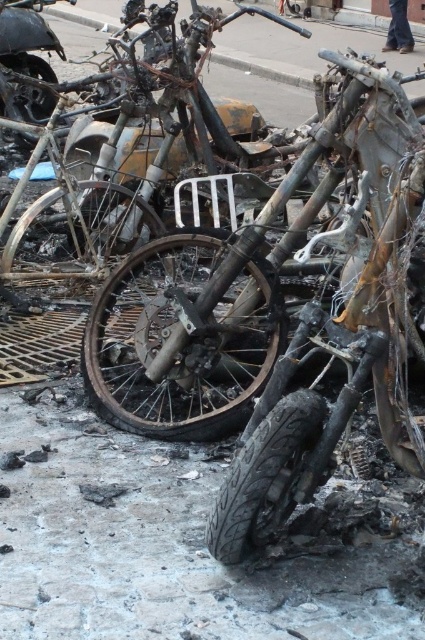
Is charcoal matte bicycle at center above charcoal rubber tire at center-left?

Actually, charcoal matte bicycle at center is below charcoal rubber tire at center-left.

This screenshot has width=425, height=640. Describe the element at coordinates (124, 145) in the screenshot. I see `charcoal matte bicycle at center` at that location.

The image size is (425, 640). I want to click on charcoal matte bicycle at center, so click(124, 145).

Is charcoal rubber tire at center wider than charcoal rubber tire at center-left?

Correct, the width of charcoal rubber tire at center exceeds that of charcoal rubber tire at center-left.

This screenshot has height=640, width=425. What are the coordinates of `charcoal rubber tire at center` in the screenshot? It's located at (181, 339).

Consider the image. Which is below, burnt metallic bicycle at center or charred metal motorcycle at upper left?

Positioned lower is burnt metallic bicycle at center.

Who is positioned more to the left, burnt metallic bicycle at center or charred metal motorcycle at upper left?

Positioned to the left is charred metal motorcycle at upper left.

Is point (107, 320) in front of point (42, 112)?

Yes, point (107, 320) is closer to viewer.

Locate an element on the screen. The image size is (425, 640). burnt metallic bicycle at center is located at coordinates (215, 296).